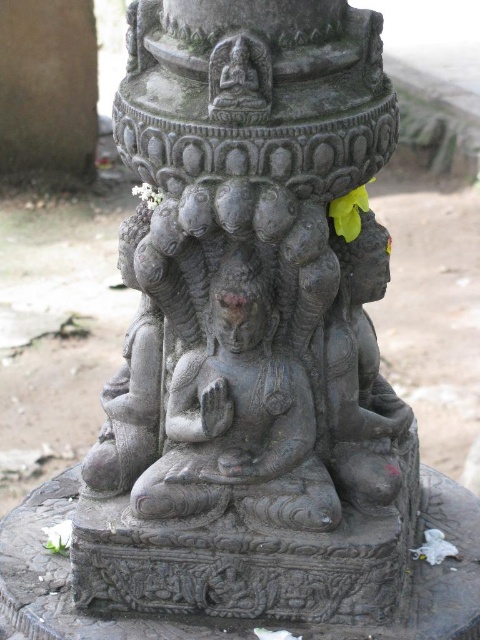
Can you confirm if black stone statue at center is thinner than white matte flower at center?

No, black stone statue at center is not thinner than white matte flower at center.

Looking at this image, can you confirm if black stone statue at center is taller than white matte flower at center?

Indeed, black stone statue at center has a greater height compared to white matte flower at center.

Does point (268, 10) come farther from viewer compared to point (160, 198)?

No, (268, 10) is closer to viewer.

Identify the location of black stone statue at center. The width and height of the screenshot is (480, 640). (251, 326).

Can you confirm if green leafy plant at upper center is positioned below white paper flower at lower left?

No, green leafy plant at upper center is not below white paper flower at lower left.

Between green leafy plant at upper center and white paper flower at lower left, which one has more height?

With more height is green leafy plant at upper center.

Describe the element at coordinates (348, 212) in the screenshot. The image size is (480, 640). I see `green leafy plant at upper center` at that location.

Locate an element on the screen. The height and width of the screenshot is (640, 480). green leafy plant at upper center is located at coordinates (348, 212).

Who is positioned more to the left, white paper flower at lower left or white matte flower at center?

white paper flower at lower left

Does white paper flower at lower left have a lesser width compared to white matte flower at center?

Yes, white paper flower at lower left is thinner than white matte flower at center.

Is point (58, 538) positioned behind point (149, 186)?

That is True.

The image size is (480, 640). Find the location of `white paper flower at lower left`. white paper flower at lower left is located at coordinates coord(59,536).